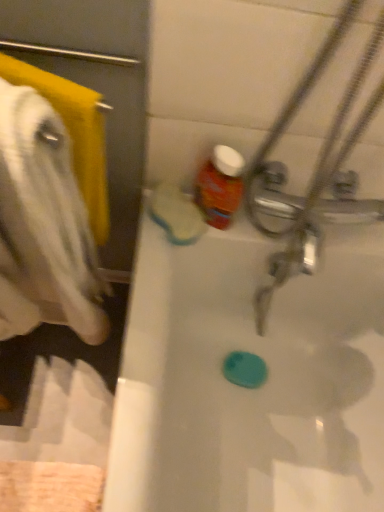
Question: Is point (248, 399) positioned closer to the camera than point (102, 143)?

Choices:
 (A) closer
 (B) farther

Answer: (B)

Question: From the image's perspective, relative to white soft towel at left, is white glossy bathtub at center above or below?

Choices:
 (A) above
 (B) below

Answer: (B)

Question: Which object is positioned farthest from the white soft towel at left?

Choices:
 (A) matte plastic bottle at upper center
 (B) white glossy bathtub at center

Answer: (B)

Question: Which object is the closest to the white soft towel at left?

Choices:
 (A) matte plastic bottle at upper center
 (B) white glossy bathtub at center

Answer: (A)